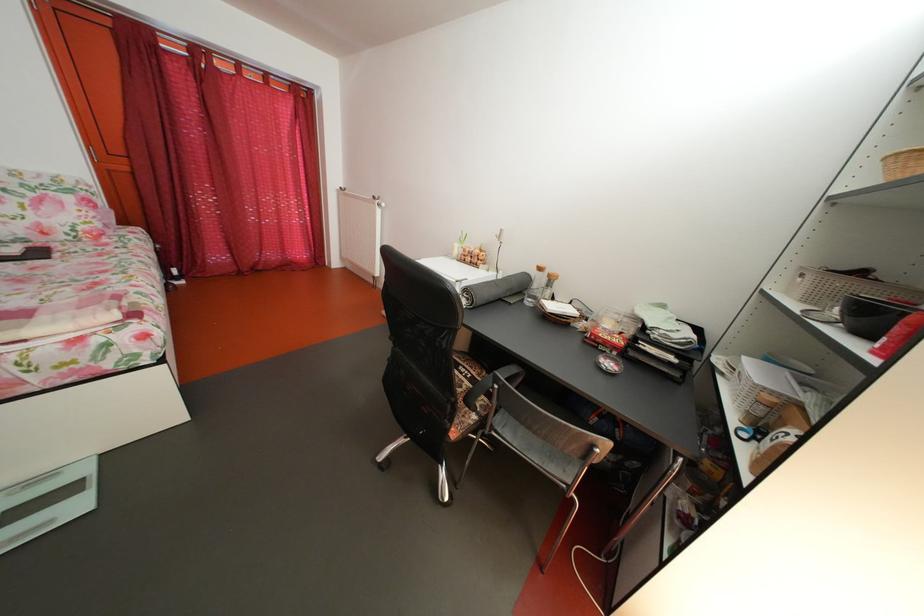
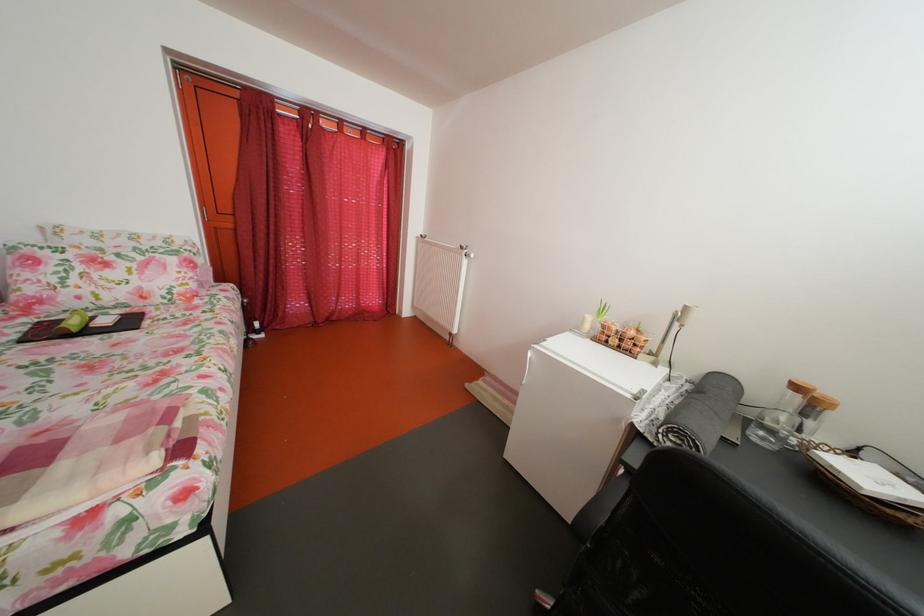
Where in the second image is the point corresponding to [385,205] from the first image?

(473, 254)